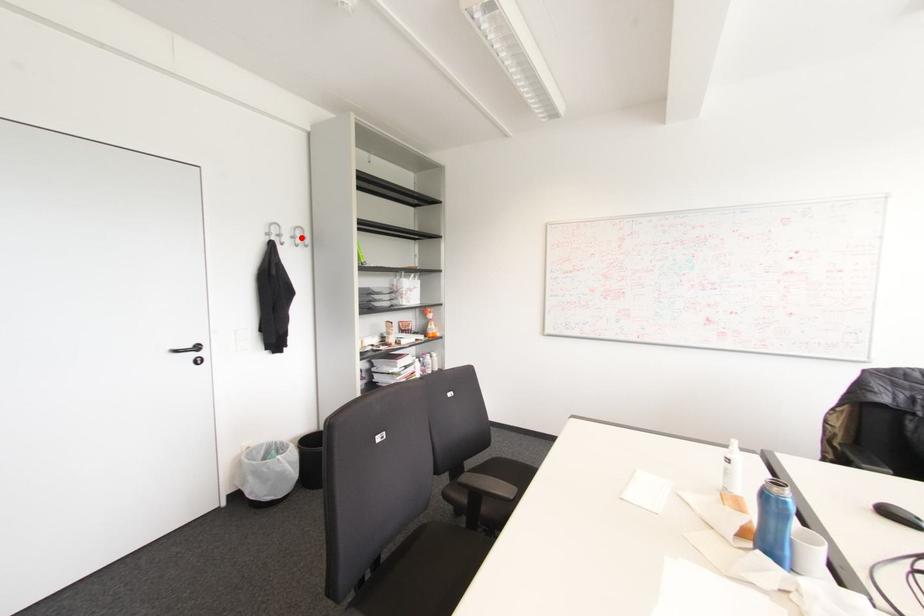
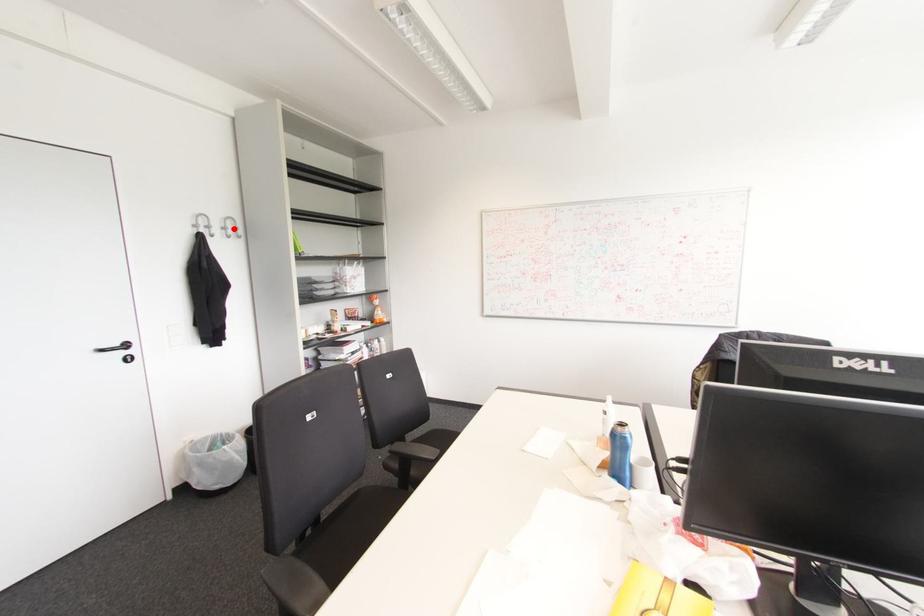
Based on the photo, I am providing you with two images of the same scene from different viewpoints. A red point is marked on the first image and another point is marked on the second image. Are the points marked in image1 and image2 representing the same 3D position?

Yes